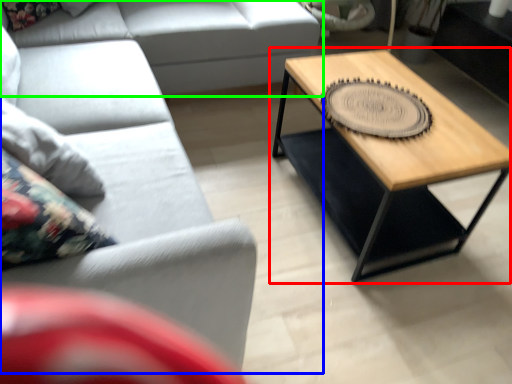
Question: Which object is positioned farthest from coffee table (highlighted by a red box)? Select from studio couch (highlighted by a blue box) and studio couch (highlighted by a green box).

Choices:
 (A) studio couch
 (B) studio couch

Answer: (B)